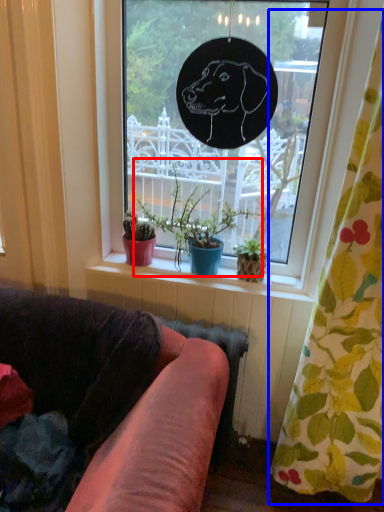
Question: Which point is further to the camera, houseplant (highlighted by a red box) or curtain (highlighted by a blue box)?

Choices:
 (A) houseplant
 (B) curtain

Answer: (A)